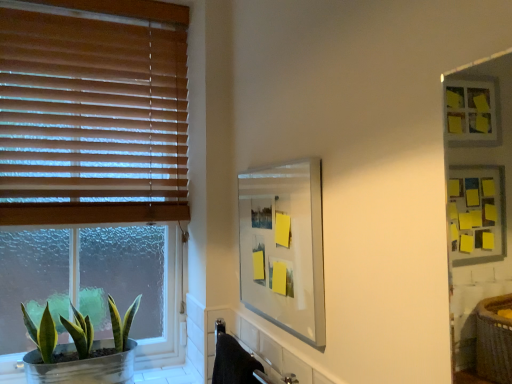
Question: From the image's perspective, is clear glass mirror at center on green matte plant at lower left?

Choices:
 (A) no
 (B) yes

Answer: (B)

Question: Can green matte plant at lower left be found inside clear glass mirror at center?

Choices:
 (A) no
 (B) yes

Answer: (A)

Question: Does clear glass mirror at center appear on the right side of green matte plant at lower left?

Choices:
 (A) yes
 (B) no

Answer: (A)

Question: Can you confirm if clear glass mirror at center is smaller than green matte plant at lower left?

Choices:
 (A) yes
 (B) no

Answer: (A)

Question: Is clear glass mirror at center shorter than green matte plant at lower left?

Choices:
 (A) no
 (B) yes

Answer: (A)

Question: Is green matte plant at lower left in front of or behind wooden blinds at left in the image?

Choices:
 (A) behind
 (B) front

Answer: (B)

Question: Is green matte plant at lower left inside the boundaries of wooden blinds at left, or outside?

Choices:
 (A) inside
 (B) outside

Answer: (B)

Question: From the image's perspective, relative to wooden blinds at left, is green matte plant at lower left above or below?

Choices:
 (A) below
 (B) above

Answer: (A)

Question: In terms of height, does green matte plant at lower left look taller or shorter compared to wooden blinds at left?

Choices:
 (A) short
 (B) tall

Answer: (A)

Question: From a real-world perspective, is clear glass mirror at center physically located above or below wooden blinds at left?

Choices:
 (A) below
 (B) above

Answer: (A)

Question: From the image's perspective, is clear glass mirror at center above or below wooden blinds at left?

Choices:
 (A) above
 (B) below

Answer: (B)

Question: Based on their positions, is clear glass mirror at center located to the left or right of wooden blinds at left?

Choices:
 (A) right
 (B) left

Answer: (A)

Question: Is point (309, 274) positioned closer to the camera than point (53, 175)?

Choices:
 (A) closer
 (B) farther

Answer: (A)

Question: Considering the positions of wooden blinds at left and clear glass mirror at center in the image, is wooden blinds at left taller or shorter than clear glass mirror at center?

Choices:
 (A) tall
 (B) short

Answer: (A)

Question: Based on their positions, is wooden blinds at left located to the left or right of clear glass mirror at center?

Choices:
 (A) right
 (B) left

Answer: (B)